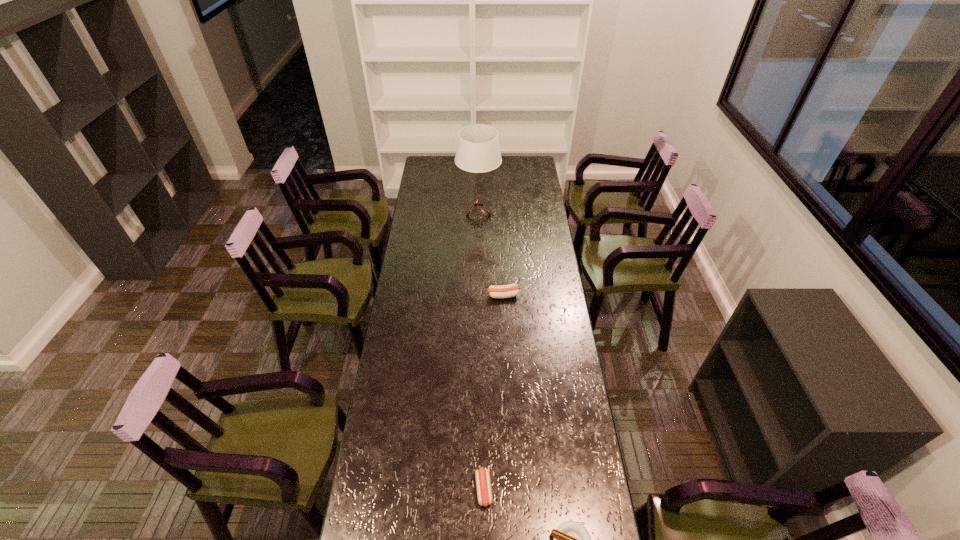
You are a GUI agent. You are given a task and a screenshot of the screen. Output one action in this format:
    pyautogui.click(x=<x>, y=<y>)
    Task: Click on the free space at the right edge of the desktop
    Image resolution: width=960 pixels, height=540 pixels.
    Given the screenshot: What is the action you would take?
    pyautogui.click(x=549, y=314)

Locate an element on the screen. free space between the third farthest object and the tallest sausage is located at coordinates point(493,392).

Identify the location of vacant area that lies between the tallest sausage and the second nearest sausage. This screenshot has width=960, height=540. (493, 392).

At what (x,y) coordinates should I click in order to perform the action: click on vacant area that lies between the table lamp and the second tallest sausage. Please return your answer as a coordinate pair (x, y). This screenshot has width=960, height=540. Looking at the image, I should click on (481, 352).

The image size is (960, 540). Identify the location of unoccupied position between the farthest object and the second tallest object. (491, 255).

Where is `free spot between the tallest object and the second nearest sausage`? The width and height of the screenshot is (960, 540). free spot between the tallest object and the second nearest sausage is located at coordinates (481, 352).

Locate an element on the screen. The image size is (960, 540). free space between the farthest object and the third farthest object is located at coordinates (481, 352).

At what (x,y) coordinates should I click in order to perform the action: click on object that is the second nearest to the farthest sausage. Please return your answer as a coordinate pair (x, y). The width and height of the screenshot is (960, 540). Looking at the image, I should click on (484, 493).

The width and height of the screenshot is (960, 540). I want to click on object that can be found as the closest to the shortest object, so click(484, 493).

Where is `sausage that stands as the closest to the shortest object`? The image size is (960, 540). sausage that stands as the closest to the shortest object is located at coordinates (484, 493).